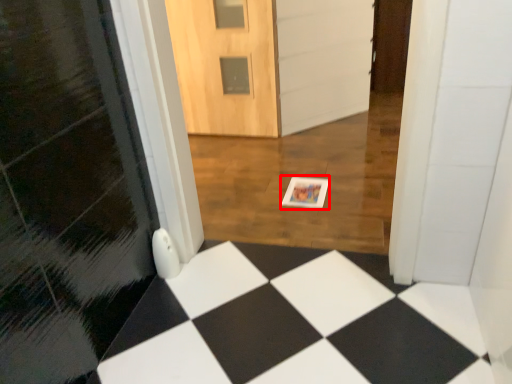
Question: From the image's perspective, where is postcard (annotated by the red box) located relative to door?

Choices:
 (A) above
 (B) below

Answer: (B)